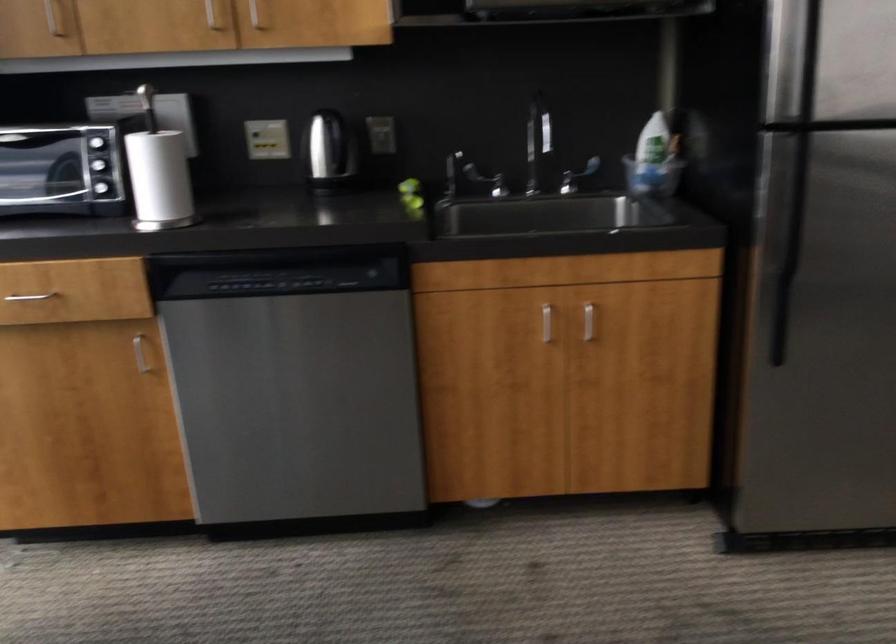
Where is `faucet handle`? The height and width of the screenshot is (644, 896). faucet handle is located at coordinates (576, 176).